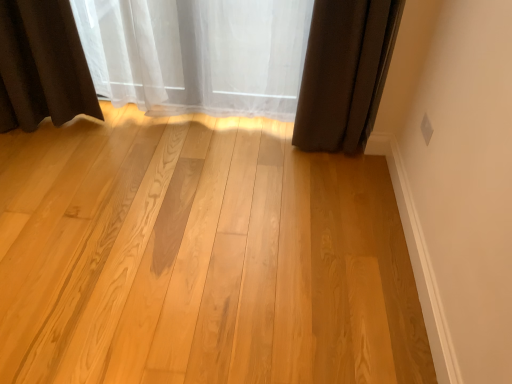
Question: Does light wood plank at center have a lesser width compared to white sheer curtain at upper center, arranged as the 2th curtain when viewed from the right?

Choices:
 (A) no
 (B) yes

Answer: (A)

Question: Can you confirm if light wood plank at center is bigger than white sheer curtain at upper center, arranged as the first curtain when viewed from the left?

Choices:
 (A) no
 (B) yes

Answer: (B)

Question: Is there a large distance between light wood plank at center and white sheer curtain at upper center, arranged as the first curtain when viewed from the left?

Choices:
 (A) yes
 (B) no

Answer: (B)

Question: Would you say light wood plank at center is outside white sheer curtain at upper center, arranged as the 2th curtain when viewed from the right?

Choices:
 (A) no
 (B) yes

Answer: (B)

Question: Is white sheer curtain at upper center, arranged as the 2th curtain when viewed from the right, located within light wood plank at center?

Choices:
 (A) yes
 (B) no

Answer: (B)

Question: Is light wood plank at center at the left side of white sheer curtain at upper center, arranged as the first curtain when viewed from the left?

Choices:
 (A) yes
 (B) no

Answer: (A)

Question: Is dark brown fabric curtain at upper right, arranged as the second curtain when viewed from the left, positioned beyond the bounds of white sheer curtain at upper center, arranged as the first curtain when viewed from the left?

Choices:
 (A) no
 (B) yes

Answer: (B)

Question: Does dark brown fabric curtain at upper right, arranged as the second curtain when viewed from the left, have a greater width compared to white sheer curtain at upper center, arranged as the first curtain when viewed from the left?

Choices:
 (A) yes
 (B) no

Answer: (A)

Question: Is the position of dark brown fabric curtain at upper right, the 1th curtain in the right-to-left sequence, more distant than that of white sheer curtain at upper center, arranged as the 2th curtain when viewed from the right?

Choices:
 (A) no
 (B) yes

Answer: (A)

Question: Does dark brown fabric curtain at upper right, arranged as the second curtain when viewed from the left, have a larger size compared to white sheer curtain at upper center, arranged as the 2th curtain when viewed from the right?

Choices:
 (A) yes
 (B) no

Answer: (B)

Question: From the image's perspective, is dark brown fabric curtain at upper right, arranged as the second curtain when viewed from the left, beneath white sheer curtain at upper center, arranged as the first curtain when viewed from the left?

Choices:
 (A) yes
 (B) no

Answer: (A)

Question: Are dark brown fabric curtain at upper right, the 1th curtain in the right-to-left sequence, and white sheer curtain at upper center, arranged as the 2th curtain when viewed from the right, far apart?

Choices:
 (A) yes
 (B) no

Answer: (B)

Question: Is light wood plank at center placed right next to dark brown fabric curtain at upper right, arranged as the second curtain when viewed from the left?

Choices:
 (A) no
 (B) yes

Answer: (A)